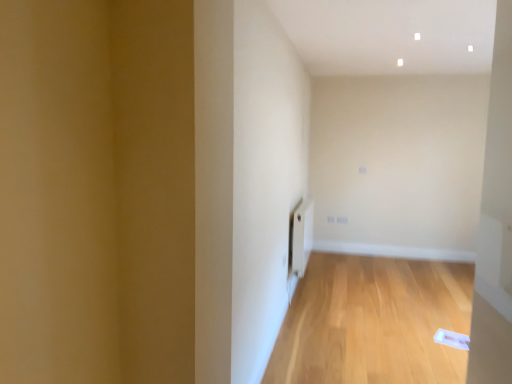
Question: Relative to white matte radiator at center, is light wood floor at center in front or behind?

Choices:
 (A) behind
 (B) front

Answer: (B)

Question: Considering the positions of light wood floor at center and white matte radiator at center in the image, is light wood floor at center wider or thinner than white matte radiator at center?

Choices:
 (A) wide
 (B) thin

Answer: (A)

Question: Visually, is light wood floor at center positioned to the left or to the right of white matte radiator at center?

Choices:
 (A) left
 (B) right

Answer: (B)

Question: Is white matte radiator at center situated inside light wood floor at center or outside?

Choices:
 (A) inside
 (B) outside

Answer: (B)

Question: Considering the positions of white matte radiator at center and light wood floor at center in the image, is white matte radiator at center bigger or smaller than light wood floor at center?

Choices:
 (A) big
 (B) small

Answer: (B)

Question: Relative to light wood floor at center, is white matte radiator at center in front or behind?

Choices:
 (A) front
 (B) behind

Answer: (B)

Question: Visually, is white matte radiator at center positioned to the left or to the right of light wood floor at center?

Choices:
 (A) right
 (B) left

Answer: (B)